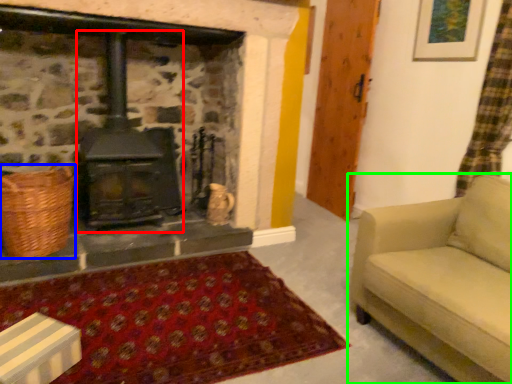
Question: Which object is the closest to the wood burning stove (highlighted by a red box)? Choose among these: basket (highlighted by a blue box) or studio couch (highlighted by a green box).

Choices:
 (A) basket
 (B) studio couch

Answer: (A)